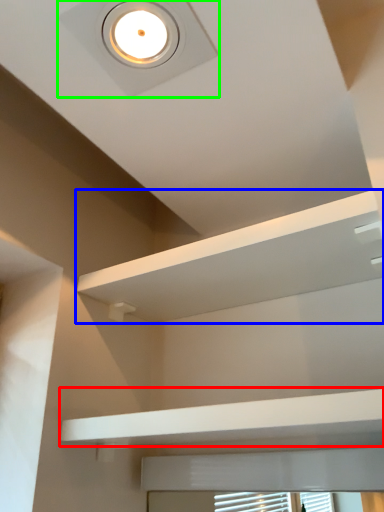
Question: Which is nearer to the balustrade (highlighted by a red box)? shelf (highlighted by a blue box) or droplight (highlighted by a green box).

Choices:
 (A) shelf
 (B) droplight

Answer: (A)